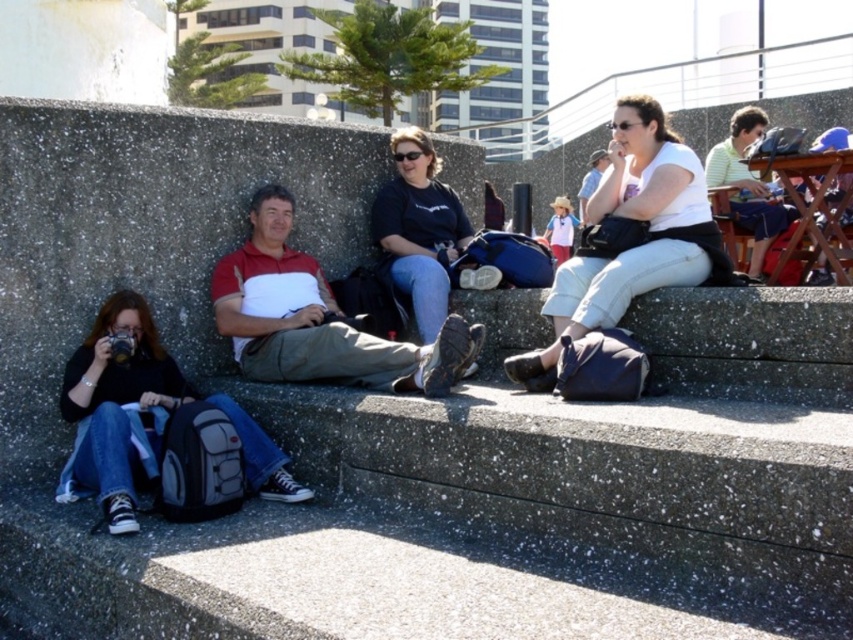
You are a photographer trying to capture a group shot of the white matte shirt at upper right and the black matte shirt at center. Which person should you focus on first if you want to ensure they are fully in the frame?

The white matte shirt at upper right should be focused on first since it occupies less space and might be harder to capture fully in the frame compared to the black matte shirt at center.

You are standing at point (614, 138) and want to take a photo using the camera. Can you reach the camera from your current position without moving?

The distance between point (614, 138) and the camera is 35.57 feet, so you cannot reach the camera without moving since it is too far away.

You are an event planner organizing a photoshoot and need to arrange two models wearing the white matte shirt at upper right and the black matte shirt at center. Which model should you place in a position that requires a wider space?

The black matte shirt at center should be placed in the position requiring wider space because its width is greater than the white matte shirt at upper right.